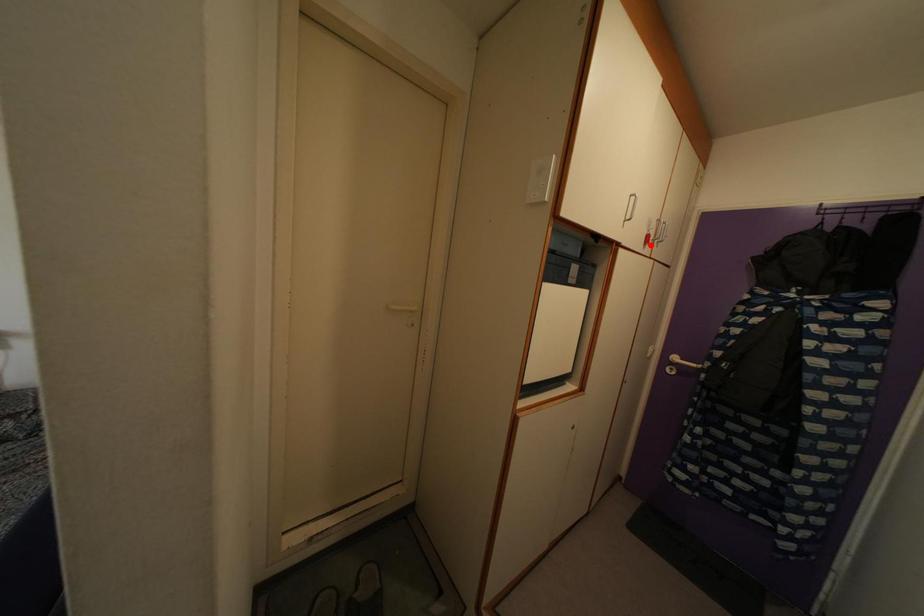
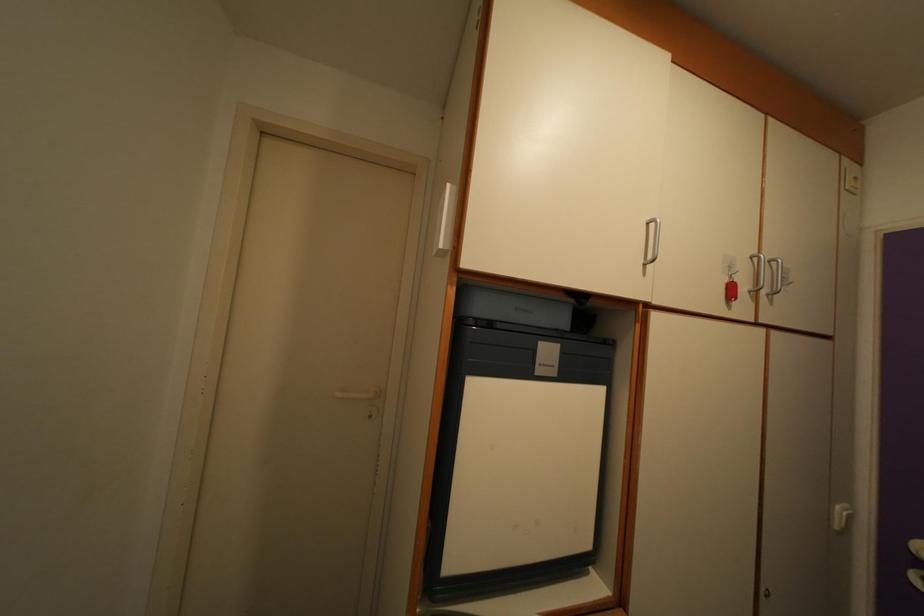
Locate, in the second image, the point that corresponds to the highlighted location in the first image.

(735, 294)